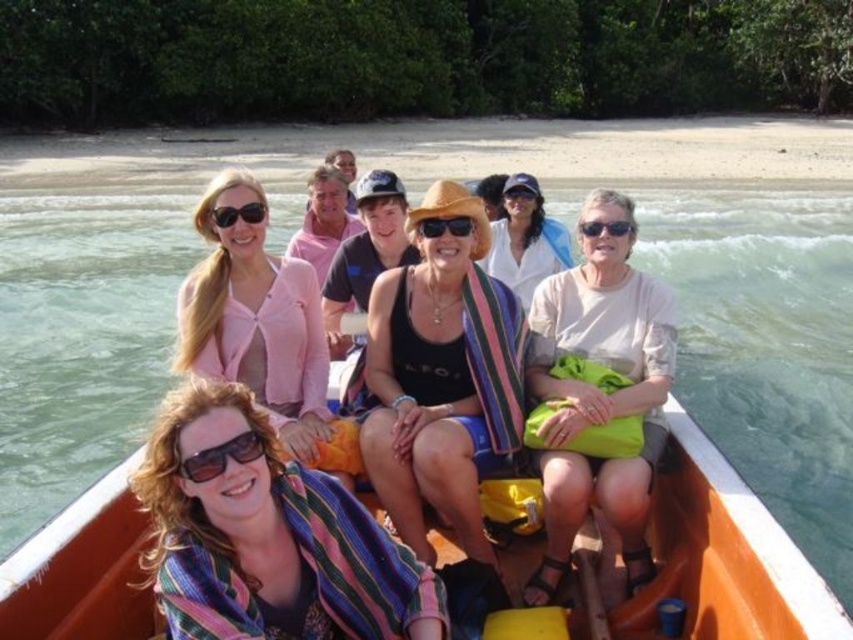
Looking at this image, you are a photographer standing on the shore and want to take a photo of the matte black tank top at center and the black plastic goggles at center. Which object should you focus on first to ensure both are in focus?

You should focus on the matte black tank top at center first because it is much taller than the black plastic goggles at center, so it will be in focus first.

You are a photographer trying to capture a clear shot of the black plastic goggles at center. Since the matte black tank top at center is blocking the view, can you estimate if moving the camera slightly to the right would help frame the goggles better?

The matte black tank top at center is wider than the black plastic goggles at center, so moving the camera to the right might help frame the goggles by shifting the focus away from the wider tank top.